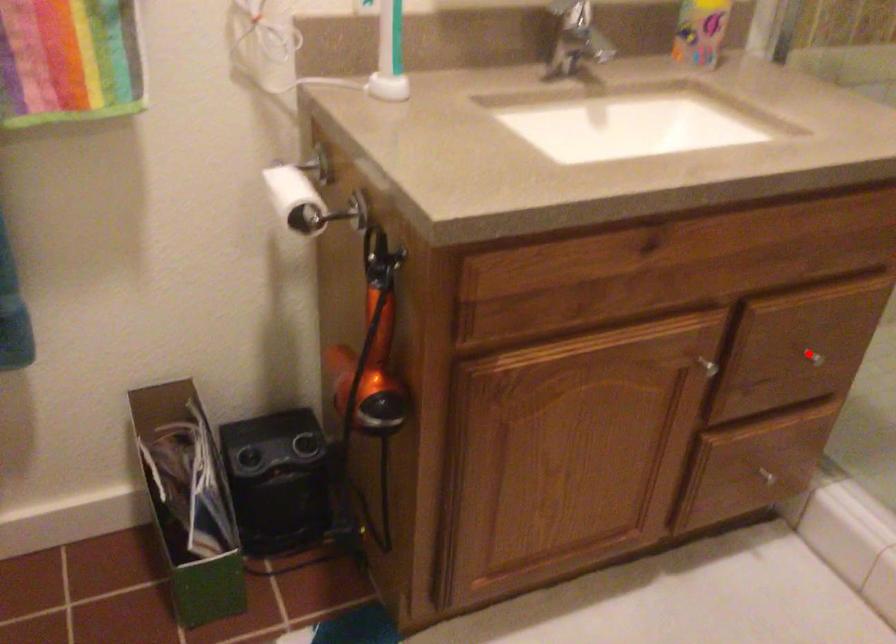
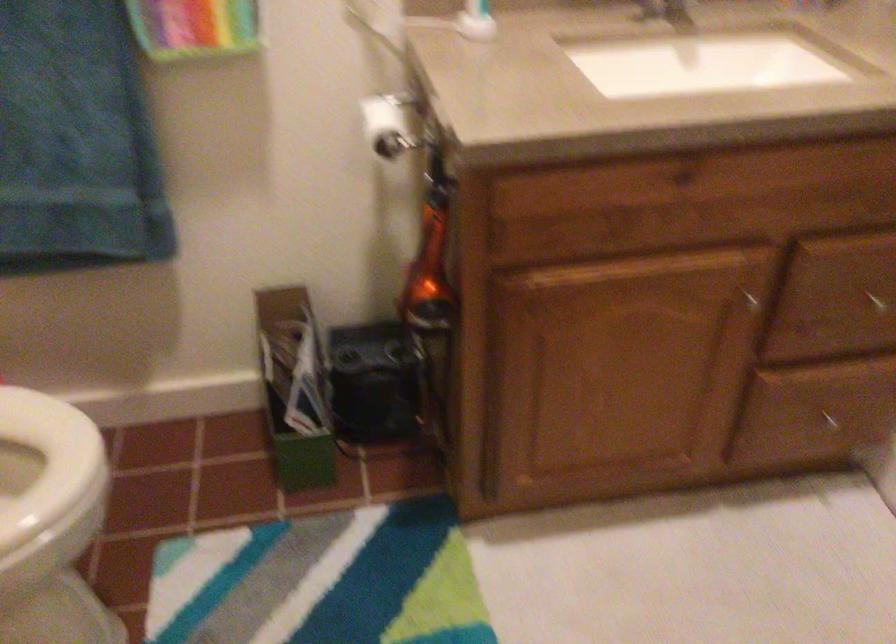
Locate, in the second image, the point that corresponds to the highlighted location in the first image.

(875, 301)